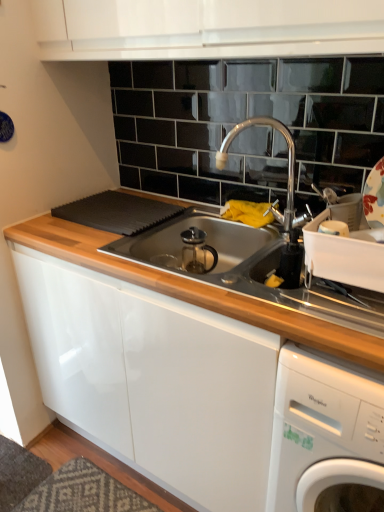
What do you see at coordinates (288, 172) in the screenshot?
I see `polished chrome faucet at upper center` at bounding box center [288, 172].

The width and height of the screenshot is (384, 512). Identify the location of polished chrome faucet at upper center. (288, 172).

What do you see at coordinates (325, 437) in the screenshot?
I see `white glossy washing machine at lower right` at bounding box center [325, 437].

Locate an element on the screen. This screenshot has height=512, width=384. white glossy washing machine at lower right is located at coordinates (325, 437).

Find the location of a particular element. polished chrome faucet at upper center is located at coordinates click(x=288, y=172).

Is white glossy washing machine at lower right at the right side of polished chrome faucet at upper center?

Correct, you'll find white glossy washing machine at lower right to the right of polished chrome faucet at upper center.

Considering their positions, is white glossy washing machine at lower right located in front of or behind polished chrome faucet at upper center?

Clearly, white glossy washing machine at lower right is in front of polished chrome faucet at upper center.

Considering the points (319, 499) and (290, 228), which point is behind, point (319, 499) or point (290, 228)?

The point (290, 228) is farther from the camera.

From the image's perspective, is white glossy washing machine at lower right over polished chrome faucet at upper center?

No.

From a real-world perspective, is white glossy washing machine at lower right above or below polished chrome faucet at upper center?

Clearly, from a real-world perspective, white glossy washing machine at lower right is below polished chrome faucet at upper center.

Considering the relative sizes of white glossy washing machine at lower right and polished chrome faucet at upper center in the image provided, is white glossy washing machine at lower right thinner than polished chrome faucet at upper center?

No.

Considering the relative sizes of white glossy washing machine at lower right and polished chrome faucet at upper center in the image provided, is white glossy washing machine at lower right taller than polished chrome faucet at upper center?

Yes.

Can you confirm if white glossy washing machine at lower right is smaller than polished chrome faucet at upper center?

Actually, white glossy washing machine at lower right might be larger than polished chrome faucet at upper center.

Choose the correct answer: Is white glossy washing machine at lower right inside polished chrome faucet at upper center or outside it?

white glossy washing machine at lower right is outside polished chrome faucet at upper center.

Would you say white glossy washing machine at lower right is a long distance from polished chrome faucet at upper center?

white glossy washing machine at lower right is actually quite close to polished chrome faucet at upper center.

Is white glossy washing machine at lower right aimed at polished chrome faucet at upper center?

No, white glossy washing machine at lower right is not aimed at polished chrome faucet at upper center.

Can you tell me how much white glossy washing machine at lower right and polished chrome faucet at upper center differ in facing direction?

The angle between the facing direction of white glossy washing machine at lower right and the facing direction of polished chrome faucet at upper center is 54 degrees.

How far apart are white glossy washing machine at lower right and polished chrome faucet at upper center?

The distance of white glossy washing machine at lower right from polished chrome faucet at upper center is 24.31 inches.

Identify the location of home appliance below the polished chrome faucet at upper center (from the image's perspective). (325, 437).

Does polished chrome faucet at upper center appear on the left side of white glossy washing machine at lower right?

Correct, you'll find polished chrome faucet at upper center to the left of white glossy washing machine at lower right.

Between polished chrome faucet at upper center and white glossy washing machine at lower right, which one is positioned in front?

white glossy washing machine at lower right is more forward.

Is point (231, 141) less distant than point (288, 496)?

No, (231, 141) is behind (288, 496).

From the image's perspective, is polished chrome faucet at upper center under white glossy washing machine at lower right?

No, from the image's perspective, polished chrome faucet at upper center is not below white glossy washing machine at lower right.

From the picture: From a real-world perspective, is polished chrome faucet at upper center located higher than white glossy washing machine at lower right?

Yes.

Which object is thinner, polished chrome faucet at upper center or white glossy washing machine at lower right?

polished chrome faucet at upper center.

Considering the sizes of objects polished chrome faucet at upper center and white glossy washing machine at lower right in the image provided, who is taller, polished chrome faucet at upper center or white glossy washing machine at lower right?

Standing taller between the two is white glossy washing machine at lower right.

Can you confirm if polished chrome faucet at upper center is smaller than white glossy washing machine at lower right?

Indeed, polished chrome faucet at upper center has a smaller size compared to white glossy washing machine at lower right.

Can white glossy washing machine at lower right be found inside polished chrome faucet at upper center?

No, polished chrome faucet at upper center does not contain white glossy washing machine at lower right.

Is polished chrome faucet at upper center far from white glossy washing machine at lower right?

No, there isn't a large distance between polished chrome faucet at upper center and white glossy washing machine at lower right.

Is polished chrome faucet at upper center aimed at white glossy washing machine at lower right?

No, polished chrome faucet at upper center is not turned towards white glossy washing machine at lower right.

What's the angular difference between polished chrome faucet at upper center and white glossy washing machine at lower right's facing directions?

The angular difference between polished chrome faucet at upper center and white glossy washing machine at lower right is 54 degrees.

Could you measure the distance between polished chrome faucet at upper center and white glossy washing machine at lower right?

61.74 centimeters.

This screenshot has height=512, width=384. Identify the location of tap above the white glossy washing machine at lower right (from the image's perspective). pyautogui.click(x=288, y=172).

You are a GUI agent. You are given a task and a screenshot of the screen. Output one action in this format:
    pyautogui.click(x=<x>, y=<y>)
    Task: Click on the home appliance located underneath the polished chrome faucet at upper center (from a real-world perspective)
    
    Given the screenshot: What is the action you would take?
    pyautogui.click(x=325, y=437)

The width and height of the screenshot is (384, 512). In order to click on tap above the white glossy washing machine at lower right (from the image's perspective) in this screenshot , I will do click(x=288, y=172).